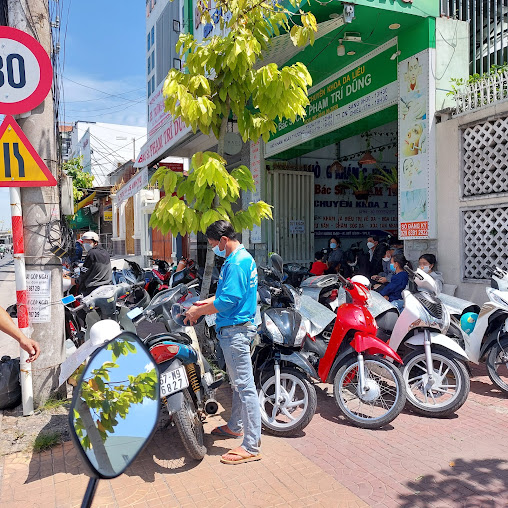
At what (x,y) coordinates should I click in order to perform the action: click on mirrors. Please return your answer as a coordinate pair (x, y). This screenshot has height=508, width=508. Looking at the image, I should click on (124, 415).